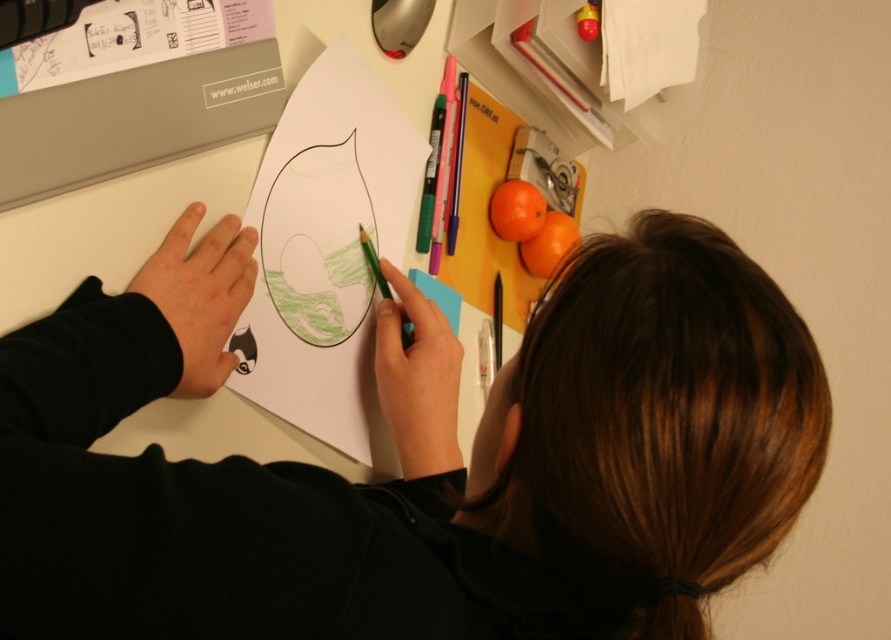
Question: Considering the real-world distances, which object is farthest from the orange matte at upper right?

Choices:
 (A) green paper at center
 (B) orange matte at upper center

Answer: (A)

Question: Where is black matte hoodie at center located in relation to green paper at center in the image?

Choices:
 (A) below
 (B) above

Answer: (A)

Question: Does green paper at center appear over orange matte at upper right?

Choices:
 (A) no
 (B) yes

Answer: (A)

Question: Among these points, which one is farthest from the camera?

Choices:
 (A) (755, 476)
 (B) (360, 166)
 (C) (538, 221)
 (D) (541, 227)

Answer: (D)

Question: Which object is the farthest from the green paper at center?

Choices:
 (A) black matte hoodie at center
 (B) orange matte at upper right
 (C) orange matte at upper center

Answer: (B)

Question: Does orange matte at upper center have a greater width compared to orange matte at upper right?

Choices:
 (A) no
 (B) yes

Answer: (A)